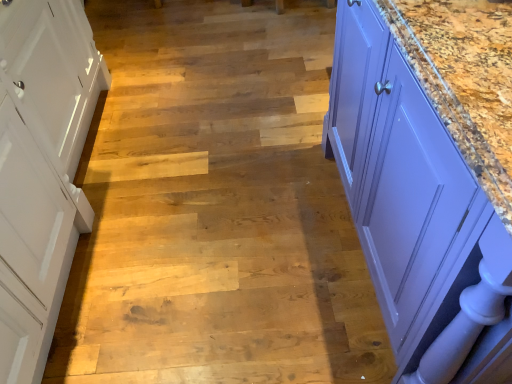
The width and height of the screenshot is (512, 384). I want to click on purple glossy cabinet at right, so click(x=430, y=176).

Image resolution: width=512 pixels, height=384 pixels. Identify the location of white wood cabinet at left. (41, 169).

Identify the location of wooden stair at center. This screenshot has height=384, width=512. (216, 208).

Do you think purple glossy cabinet at right is within white wood cabinet at left, or outside of it?

purple glossy cabinet at right is located beyond the bounds of white wood cabinet at left.

Considering the sizes of purple glossy cabinet at right and white wood cabinet at left in the image, is purple glossy cabinet at right taller or shorter than white wood cabinet at left?

Clearly, purple glossy cabinet at right is taller compared to white wood cabinet at left.

Are purple glossy cabinet at right and white wood cabinet at left beside each other?

There is a gap between purple glossy cabinet at right and white wood cabinet at left.

Find the location of a particular element. countertop above the white wood cabinet at left (from a real-world perspective) is located at coordinates (430, 176).

Which is behind, point (121, 104) or point (480, 144)?

Point (121, 104)

Is wooden stair at center positioned with its back to purple glossy cabinet at right?

No.

From their relative heights in the image, would you say wooden stair at center is taller or shorter than purple glossy cabinet at right?

Considering their sizes, wooden stair at center has less height than purple glossy cabinet at right.

Could white wood cabinet at left be considered to be inside wooden stair at center?

No.

Consider the image. Can you confirm if wooden stair at center is positioned to the left of white wood cabinet at left?

No.

Looking at this image, is wooden stair at center with white wood cabinet at left?

wooden stair at center and white wood cabinet at left are clearly separated.

Locate an element on the screen. This screenshot has width=512, height=384. stair directly beneath the white wood cabinet at left (from a real-world perspective) is located at coordinates (216, 208).

Which of these two, white wood cabinet at left or wooden stair at center, stands taller?

white wood cabinet at left is taller.

In the scene shown: From a real-world perspective, is white wood cabinet at left physically below wooden stair at center?

No, from a real-world perspective, white wood cabinet at left is not beneath wooden stair at center.

Is white wood cabinet at left not close to wooden stair at center?

No.

From the image's perspective, between white wood cabinet at left and wooden stair at center, which one is located above?

wooden stair at center, from the image's perspective.

From the image's perspective, is white wood cabinet at left below purple glossy cabinet at right?

Yes, from the image's perspective, white wood cabinet at left is beneath purple glossy cabinet at right.

You are a GUI agent. You are given a task and a screenshot of the screen. Output one action in this format:
    pyautogui.click(x=<x>, y=<y>)
    Task: Click on the countertop above the white wood cabinet at left (from the image's perspective)
    The width and height of the screenshot is (512, 384).
    Given the screenshot: What is the action you would take?
    pyautogui.click(x=430, y=176)

Who is more distant, white wood cabinet at left or purple glossy cabinet at right?

white wood cabinet at left is further from the camera.

Relative to wooden stair at center, is purple glossy cabinet at right in front or behind?

In the image, purple glossy cabinet at right appears in front of wooden stair at center.

Which of these two, purple glossy cabinet at right or wooden stair at center, is wider?

With larger width is wooden stair at center.

Locate an element on the screen. The image size is (512, 384). stair directly beneath the purple glossy cabinet at right (from a real-world perspective) is located at coordinates (216, 208).

Based on the photo, from a real-world perspective, who is located higher, purple glossy cabinet at right or wooden stair at center?

purple glossy cabinet at right is physically above.

Where is `countertop that is above the white wood cabinet at left (from a real-world perspective)`? countertop that is above the white wood cabinet at left (from a real-world perspective) is located at coordinates (430, 176).

Image resolution: width=512 pixels, height=384 pixels. What are the coordinates of `stair above the purple glossy cabinet at right (from the image's perspective)` in the screenshot? It's located at (216, 208).

From the image, which object appears to be nearer to wooden stair at center, purple glossy cabinet at right or white wood cabinet at left?

white wood cabinet at left is closer to wooden stair at center.

Based on their spatial positions, is white wood cabinet at left or wooden stair at center further from purple glossy cabinet at right?

The object further to purple glossy cabinet at right is white wood cabinet at left.

Which object lies further to the anchor point purple glossy cabinet at right, wooden stair at center or white wood cabinet at left?

Among the two, white wood cabinet at left is located further to purple glossy cabinet at right.

Based on their spatial positions, is purple glossy cabinet at right or wooden stair at center further from white wood cabinet at left?

The object further to white wood cabinet at left is purple glossy cabinet at right.

From the image, which object appears to be nearer to white wood cabinet at left, wooden stair at center or purple glossy cabinet at right?

wooden stair at center is closer to white wood cabinet at left.

When comparing their distances from wooden stair at center, does white wood cabinet at left or purple glossy cabinet at right seem further?

purple glossy cabinet at right is further to wooden stair at center.

Image resolution: width=512 pixels, height=384 pixels. What are the coordinates of `stair located between white wood cabinet at left and purple glossy cabinet at right in the left-right direction` in the screenshot? It's located at (216, 208).